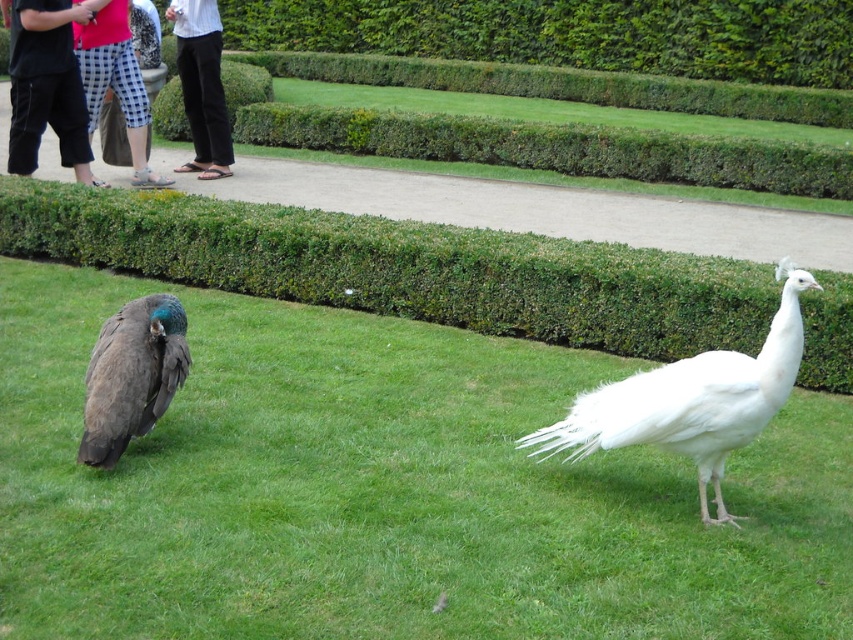
You are standing at the camera position and want to take a photo of the white feathered peacock at center. If your camera has a maximum focus range of 5 meters, will you be able to capture the peacock clearly?

The white feathered peacock at center and camera are 5.12 meters apart from each other. Since the distance exceeds the camera maximum focus range of 5 meters, you cannot capture the peacock clearly.

You are a gardener who needs to place a 10 feet long decorative fence between the green leafy hedge at center and the checkered fabric pants at left. Is there enough space to fit the fence between them?

The distance between the green leafy hedge at center and the checkered fabric pants at left is 9.30 feet, which is shorter than the 10 feet long fence. Therefore, the fence cannot be placed between them.

You are a photographer trying to capture both the white feathered peacock at center and the black pants at left in a single frame. Which of the two should you focus on first to ensure they are both in focus?

The white feathered peacock at center is smaller than the black pants at left, so you should focus on the black pants at left first to ensure both are in focus.